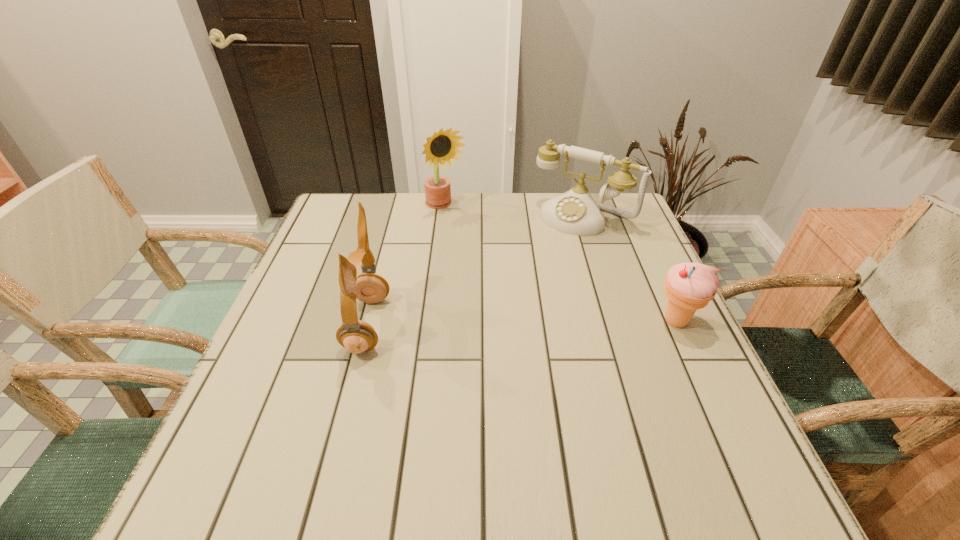
Identify the location of the leftmost object. The image size is (960, 540). (357, 336).

In order to click on icecream in this screenshot , I will do `click(689, 286)`.

Identify the location of telephone. (575, 212).

This screenshot has height=540, width=960. Find the location of `sunflower`. sunflower is located at coordinates (442, 147).

Locate an element on the screen. This screenshot has width=960, height=540. vacant region located 0.290m on the front-facing side of the earphone is located at coordinates (518, 325).

Where is `vacant space located on the back of the icecream`? vacant space located on the back of the icecream is located at coordinates (632, 225).

Locate an element on the screen. This screenshot has width=960, height=540. free location located 0.150m on the dial of the telephone is located at coordinates (539, 262).

Image resolution: width=960 pixels, height=540 pixels. I want to click on vacant area located 0.070m on the dial of the telephone, so click(551, 246).

Where is `vacant space situated 0.100m on the dial of the telephone`? vacant space situated 0.100m on the dial of the telephone is located at coordinates (547, 252).

Identify the location of vacant area situated on the face of the sunflower. The width and height of the screenshot is (960, 540). (469, 236).